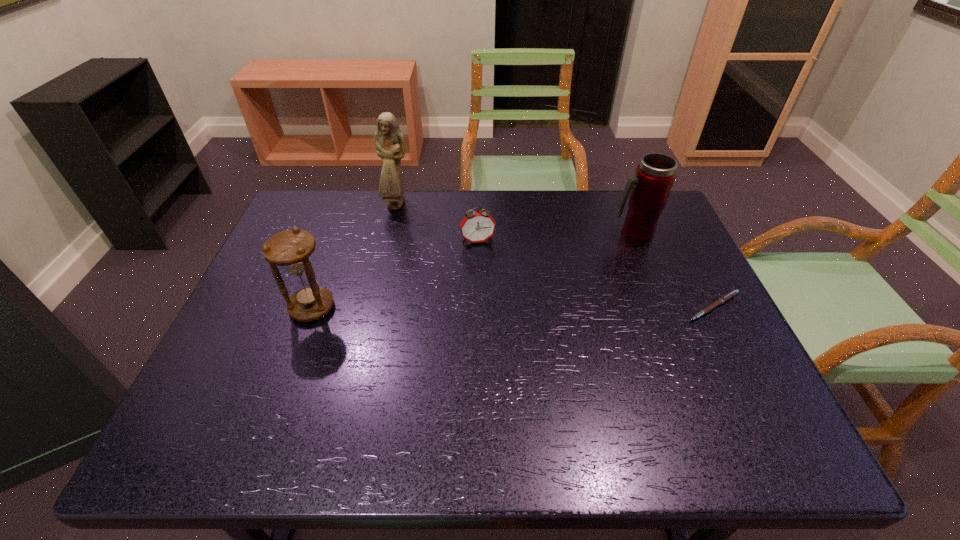
This screenshot has height=540, width=960. I want to click on vacant area situated 0.250m on the side with the handle of the thermos bottle, so click(x=580, y=290).

Where is `vacant space positioned 0.320m on the side with the handle of the thermos bottle`? vacant space positioned 0.320m on the side with the handle of the thermos bottle is located at coordinates (566, 306).

The width and height of the screenshot is (960, 540). I want to click on vacant region located on the clock face of the second shortest object, so click(487, 272).

This screenshot has height=540, width=960. I want to click on vacant space located 0.330m on the clock face of the second shortest object, so click(502, 335).

Locate an element on the screen. The image size is (960, 540). vacant area situated 0.330m on the clock face of the second shortest object is located at coordinates (502, 335).

What are the coordinates of `free region located on the front-facing side of the tallest object` in the screenshot? It's located at (407, 223).

This screenshot has height=540, width=960. In order to click on free region located on the front-facing side of the tallest object in this screenshot , I will do `click(441, 281)`.

The width and height of the screenshot is (960, 540). I want to click on vacant space located on the front-facing side of the tallest object, so (441, 281).

I want to click on thermos bottle positioned at the far edge, so click(x=649, y=189).

The width and height of the screenshot is (960, 540). Find the location of `alarm clock located in the far edge section of the desktop`. alarm clock located in the far edge section of the desktop is located at coordinates (479, 226).